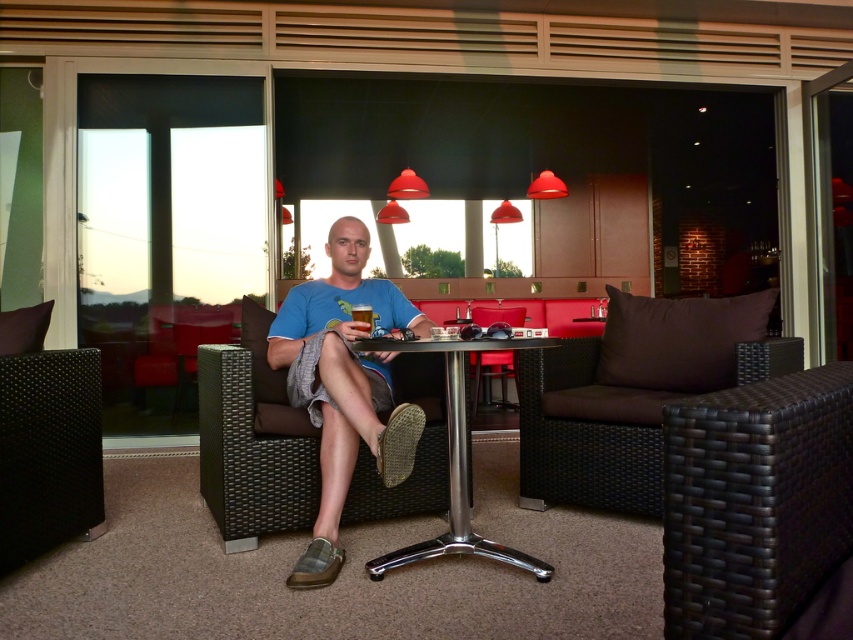
Based on the photo, you are standing in the lounge and want to determine which of the two points, point (466,476) or point (364,307), is nearer to you. Based on the scene description, which point is closer?

Point (466,476) is closer to the camera than point (364,307), so it is the nearer point.

You are a clothing designer observing the scene. You need to determine if the blue fabric shirt at center can be paired with the slip on shoes mentioned in the scene. Based on the spatial arrangement, can they be worn together?

The blue fabric shirt at center and the slip on shoes are 1.91 meters apart, which indicates they belong to the same person. Therefore, they can be worn together.

You are a server in a lounge and need to place a new drink on the polished metal table at center. The drink you have is the translucent glass beer at center. Is the height of the table sufficient to accommodate the beer?

The polished metal table at center is taller than the translucent glass beer at center, so the table has enough height to accommodate the beer.